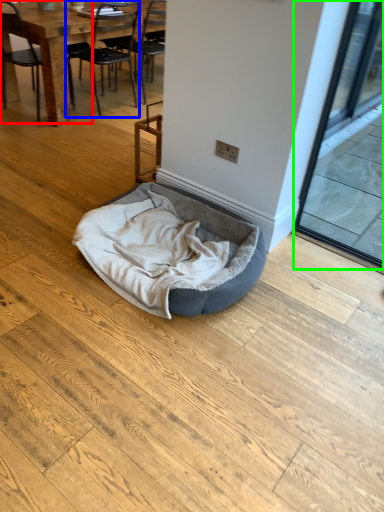
Question: Considering the real-world distances, which object is farthest from chair (highlighted by a red box)? chair (highlighted by a blue box) or screen door (highlighted by a green box)?

Choices:
 (A) chair
 (B) screen door

Answer: (B)